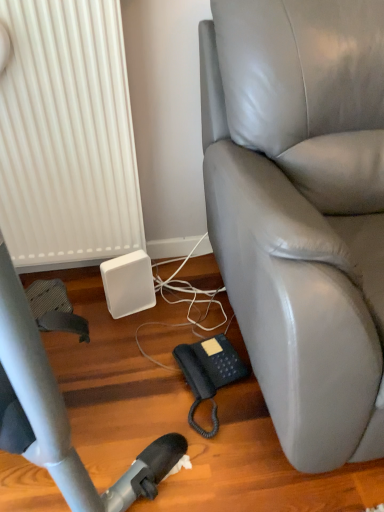
Question: Do you think white ribbed radiator at lower left is within black rubberized phone at lower center, or outside of it?

Choices:
 (A) outside
 (B) inside

Answer: (A)

Question: Looking at the image, does white ribbed radiator at lower left seem bigger or smaller compared to black rubberized phone at lower center?

Choices:
 (A) small
 (B) big

Answer: (B)

Question: Which object is positioned farthest from the white ribbed radiator at lower left?

Choices:
 (A) black rubberized phone at lower center
 (B) gray leather chair at right
 (C) white matte speaker at lower left

Answer: (A)

Question: Which of these objects is positioned farthest from the black rubberized phone at lower center?

Choices:
 (A) gray leather chair at right
 (B) white matte speaker at lower left
 (C) white ribbed radiator at lower left

Answer: (C)